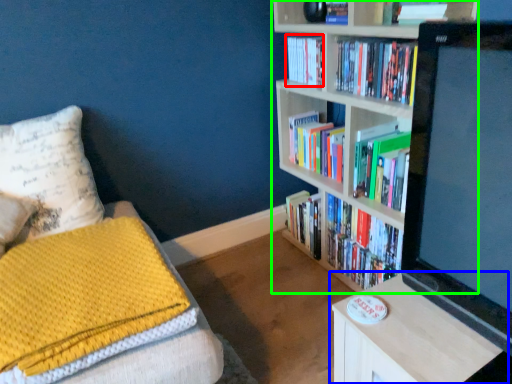
Question: Which object is positioned farthest from book (highlighted by a red box)? Select from table (highlighted by a blue box) and bookcase (highlighted by a green box).

Choices:
 (A) table
 (B) bookcase

Answer: (A)